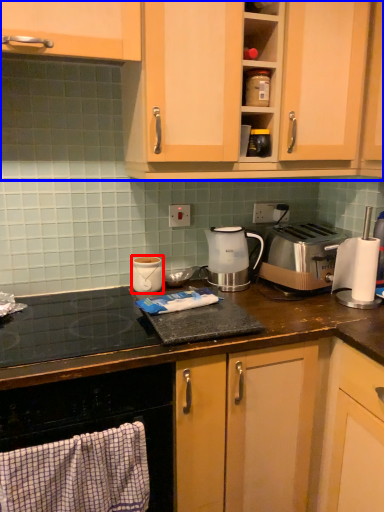
Question: Which point is further to the camera, kitchen appliance (highlighted by a red box) or cabinetry (highlighted by a blue box)?

Choices:
 (A) kitchen appliance
 (B) cabinetry

Answer: (A)